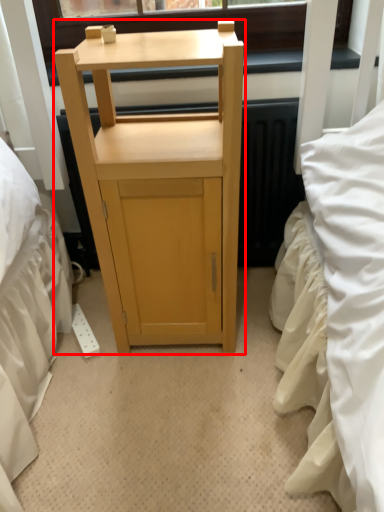
Question: From the image's perspective, where is furniture (annotated by the red box) located relative to window screen?

Choices:
 (A) above
 (B) below

Answer: (B)